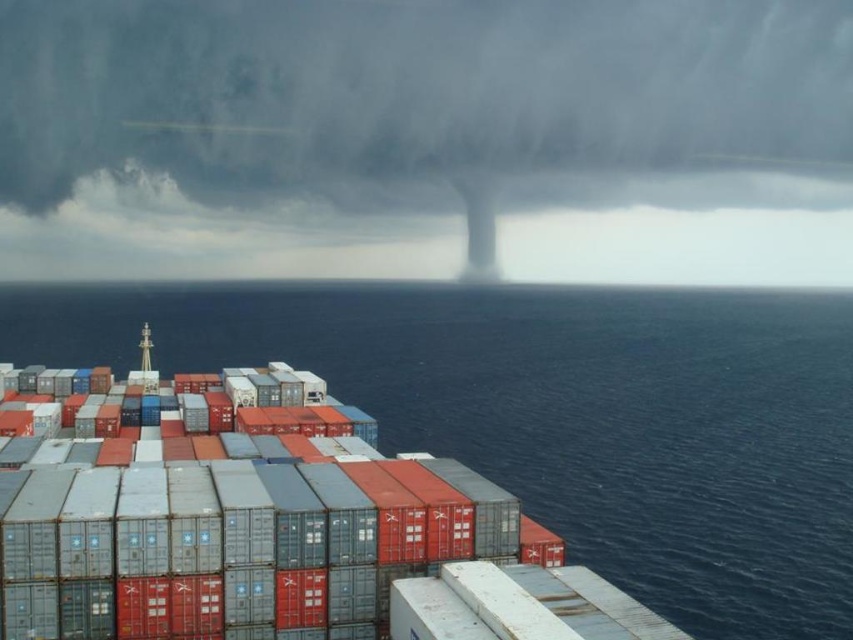
Looking at this image, based on the scene description, which object occupies a larger portion of the image between the dark gray cloud at upper center and the blue water at lower left?

The dark gray cloud at upper center is bigger than the blue water at lower left, so it occupies a larger portion of the image.

You are standing on the deck of the cargo ship and looking at two points in the scene. One is at point [389,134] and the other is at point [299,305]. Which point is closer to you?

Point [389,134] is further to the camera than point [299,305], so the point closer to you is point [299,305].

You are a sailor on a ship and you notice the dark gray cloud at upper center and the blue water at lower left. Which one appears taller from your vantage point?

The dark gray cloud at upper center appears much taller than the blue water at lower left.